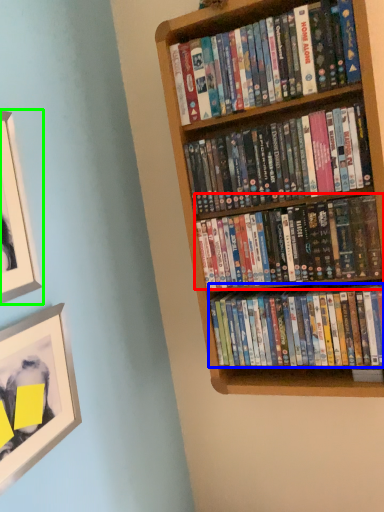
Question: Which object is the farthest from book (highlighted by a red box)? Choose among these: book (highlighted by a blue box) or picture frame (highlighted by a green box).

Choices:
 (A) book
 (B) picture frame

Answer: (B)